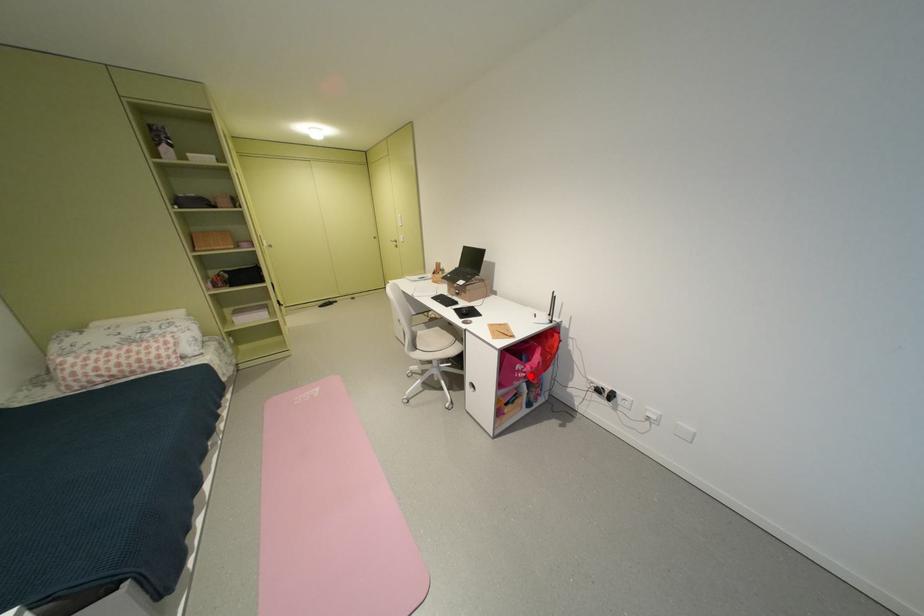
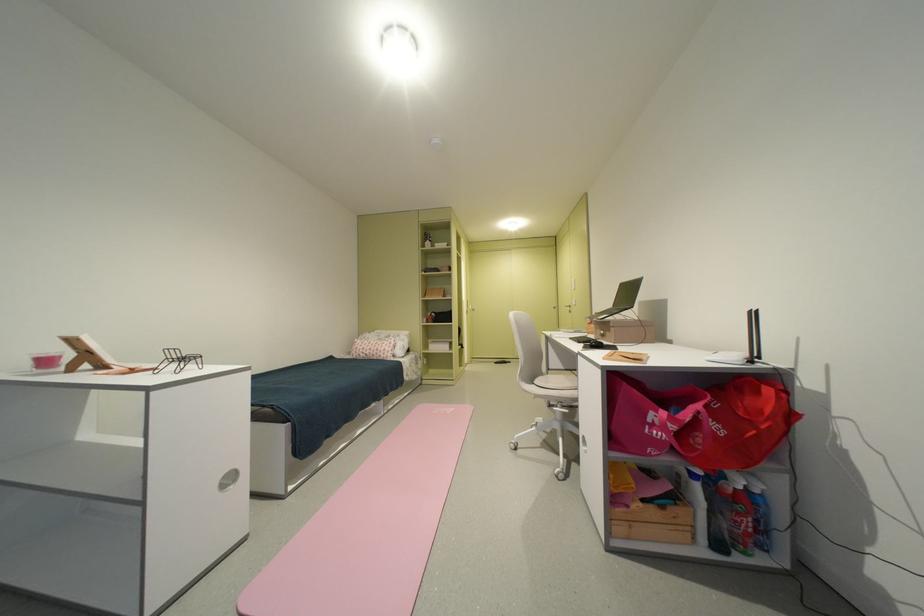
The point at the highlighted location is marked in the first image. Where is the corresponding point in the second image?

(665, 432)